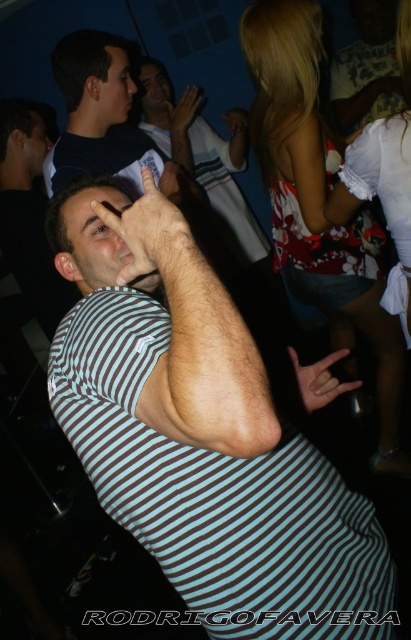
Looking at this image, can you confirm if blue striped shirt at center is positioned to the right of floral fabric dress at upper right?

In fact, blue striped shirt at center is to the left of floral fabric dress at upper right.

Is blue striped shirt at center positioned in front of floral fabric dress at upper right?

That is True.

Image resolution: width=411 pixels, height=640 pixels. Describe the element at coordinates (210, 451) in the screenshot. I see `blue striped shirt at center` at that location.

This screenshot has width=411, height=640. Identify the location of blue striped shirt at center. (x=210, y=451).

Is smooth skin face at center below matte skin hand at center?

Incorrect, smooth skin face at center is not positioned below matte skin hand at center.

Is smooth skin face at center further to camera compared to matte skin hand at center?

Yes, it is.

Does point (150, 72) lie behind point (193, 113)?

Yes, point (150, 72) is farther from viewer.

This screenshot has width=411, height=640. Identify the location of smooth skin face at center. (154, 90).

Can you confirm if striped fabric shirt at center is thinner than matte black face at upper left?

No.

Is point (235, 216) closer to viewer compared to point (25, 141)?

That is False.

Does point (189, 141) lie in front of point (44, 134)?

That is False.

Where is `striped fabric shirt at center`? striped fabric shirt at center is located at coordinates (212, 168).